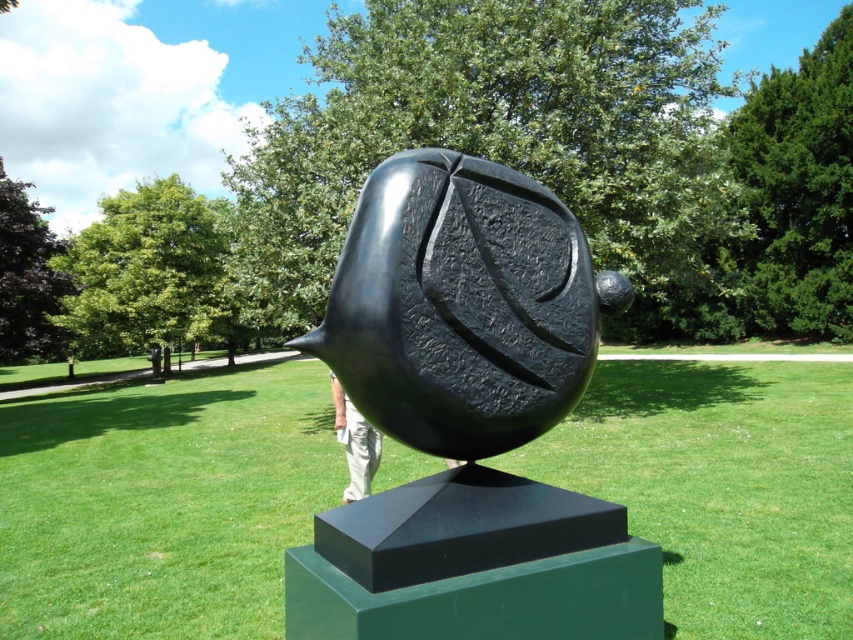
Question: Observing the image, what is the correct spatial positioning of green grass at center in reference to tan fabric pants at center?

Choices:
 (A) right
 (B) left

Answer: (A)

Question: Estimate the real-world distances between objects in this image. Which object is farther from the black polished stone sphere at center?

Choices:
 (A) tan fabric pants at center
 (B) green grass at center

Answer: (B)

Question: Among these points, which one is nearest to the camera?

Choices:
 (A) (677, 604)
 (B) (351, 442)

Answer: (A)

Question: Does black polished stone sphere at center have a greater width compared to tan fabric pants at center?

Choices:
 (A) no
 (B) yes

Answer: (B)

Question: Which point is farther to the camera?

Choices:
 (A) (579, 268)
 (B) (345, 452)

Answer: (B)

Question: Is green grass at center positioned before black polished stone sphere at center?

Choices:
 (A) yes
 (B) no

Answer: (B)